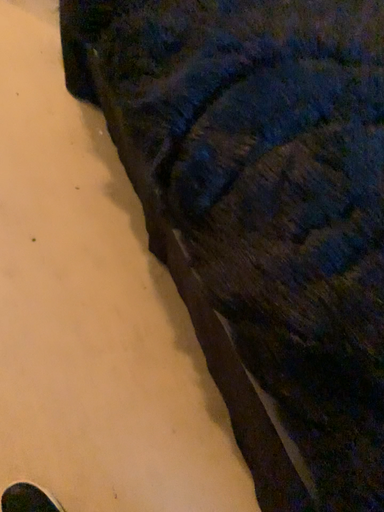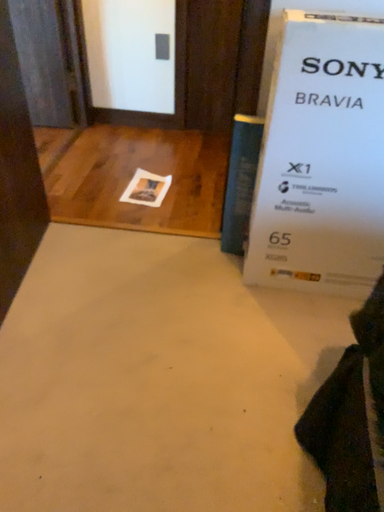
Question: Which way did the camera rotate in the video?

Choices:
 (A) rotated downward
 (B) rotated upward

Answer: (B)